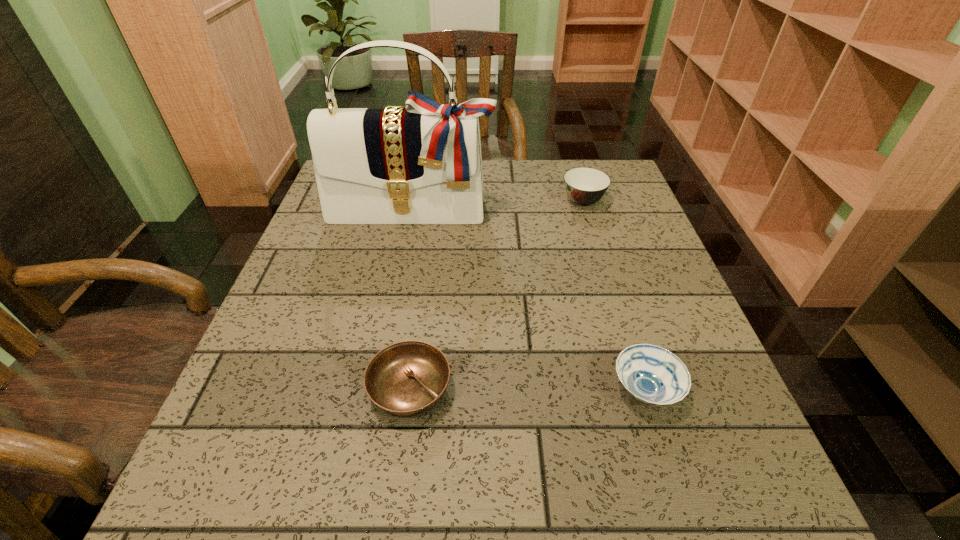
I want to click on object at the far left corner, so click(422, 164).

You are a GUI agent. You are given a task and a screenshot of the screen. Output one action in this format:
    pyautogui.click(x=<x>, y=<y>)
    Task: Click on the object that is positioned at the far right corner
    
    Given the screenshot: What is the action you would take?
    pyautogui.click(x=584, y=186)

You are a GUI agent. You are given a task and a screenshot of the screen. Output one action in this format:
    pyautogui.click(x=<x>, y=<y>)
    Task: Click on the free point at the far edge
    This screenshot has width=960, height=540.
    Given the screenshot: What is the action you would take?
    pyautogui.click(x=492, y=168)

Locate an element on the screen. The height and width of the screenshot is (540, 960). vacant area at the near edge of the desktop is located at coordinates (426, 480).

Locate an element on the screen. This screenshot has width=960, height=540. vacant space at the left edge of the desktop is located at coordinates (275, 345).

The width and height of the screenshot is (960, 540). What are the coordinates of `free space at the right edge of the desktop` in the screenshot? It's located at (657, 272).

You are a GUI agent. You are given a task and a screenshot of the screen. Output one action in this format:
    pyautogui.click(x=<x>, y=<y>)
    Task: Click on the vacant space at the far right corner of the desktop
    The height and width of the screenshot is (540, 960).
    Given the screenshot: What is the action you would take?
    pyautogui.click(x=610, y=192)

Where is `vacant space that's between the leftmost soup bowl and the farthest soup bowl`? This screenshot has width=960, height=540. vacant space that's between the leftmost soup bowl and the farthest soup bowl is located at coordinates (496, 295).

Locate which object is the closest to the tallest object. Please provide its 2D coordinates. Your answer should be formatted as a tuple, i.e. [(x, y)], where the tuple contains the x and y coordinates of a point satisfying the conditions above.

[(584, 186)]

You are a GUI agent. You are given a task and a screenshot of the screen. Output one action in this format:
    pyautogui.click(x=<x>, y=<y>)
    Task: Click on the object that is the closest to the tallest object
    This screenshot has width=960, height=540.
    Given the screenshot: What is the action you would take?
    pyautogui.click(x=584, y=186)